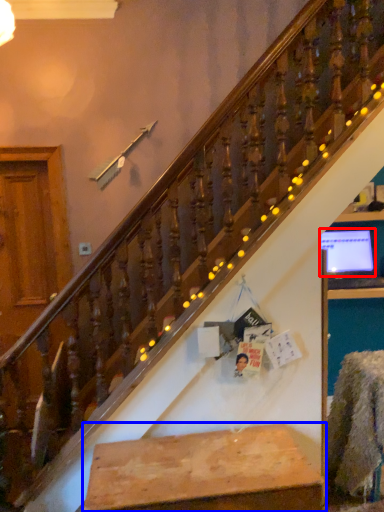
Question: Which point is closer to the camera, computer monitor (highlighted by a red box) or furniture (highlighted by a blue box)?

Choices:
 (A) computer monitor
 (B) furniture

Answer: (B)